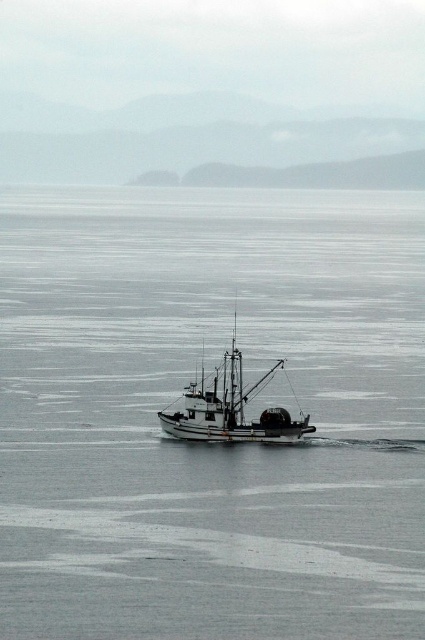
Question: Which point is closer to the camera?

Choices:
 (A) gray matte water at center
 (B) white matte fishing boat at center

Answer: (A)

Question: Observing the image, what is the correct spatial positioning of gray matte water at center in reference to white matte fishing boat at center?

Choices:
 (A) left
 (B) right

Answer: (A)

Question: Which point is farther to the camera?

Choices:
 (A) gray matte water at center
 (B) white matte fishing boat at center

Answer: (B)

Question: Does gray matte water at center appear on the left side of white matte fishing boat at center?

Choices:
 (A) no
 (B) yes

Answer: (B)

Question: Does gray matte water at center appear on the left side of white matte fishing boat at center?

Choices:
 (A) yes
 (B) no

Answer: (A)